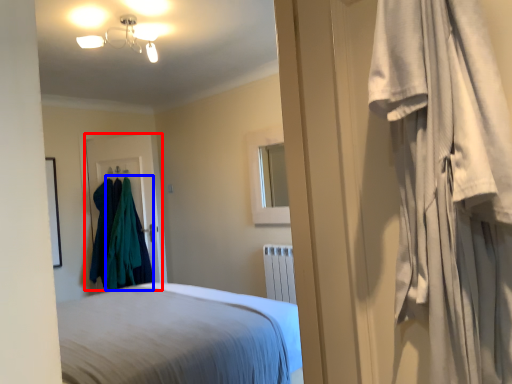
Question: Which object appears closest to the camera in this image, door (highlighted by a red box) or clothing (highlighted by a blue box)?

Choices:
 (A) door
 (B) clothing

Answer: (B)